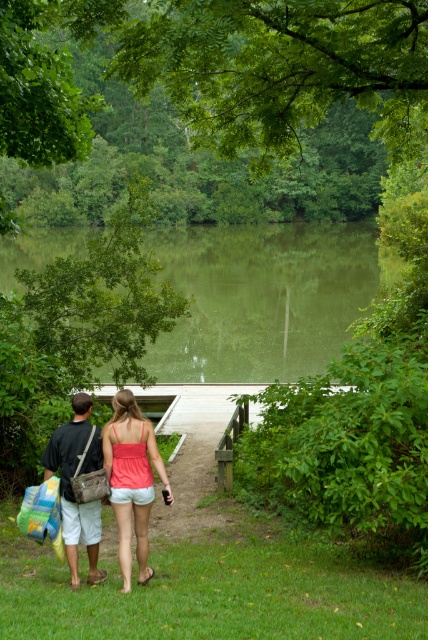
Which of these two, green reflective water at center or matte coral tank top at center, stands shorter?

With less height is matte coral tank top at center.

In the scene shown: Can you confirm if green reflective water at center is thinner than matte coral tank top at center?

In fact, green reflective water at center might be wider than matte coral tank top at center.

Where is `green reflective water at center`? The width and height of the screenshot is (428, 640). green reflective water at center is located at coordinates (264, 298).

Between point (217, 292) and point (71, 513), which one is positioned behind?

Positioned behind is point (217, 292).

Is point (171, 353) more distant than point (83, 508)?

Yes, point (171, 353) is farther from viewer.

Locate an element on the screen. green reflective water at center is located at coordinates (264, 298).

Where is `matte coral tank top at center`? The height and width of the screenshot is (640, 428). matte coral tank top at center is located at coordinates (131, 480).

What do you see at coordinates (131, 480) in the screenshot? I see `matte coral tank top at center` at bounding box center [131, 480].

Where is `matte coral tank top at center`? matte coral tank top at center is located at coordinates (131, 480).